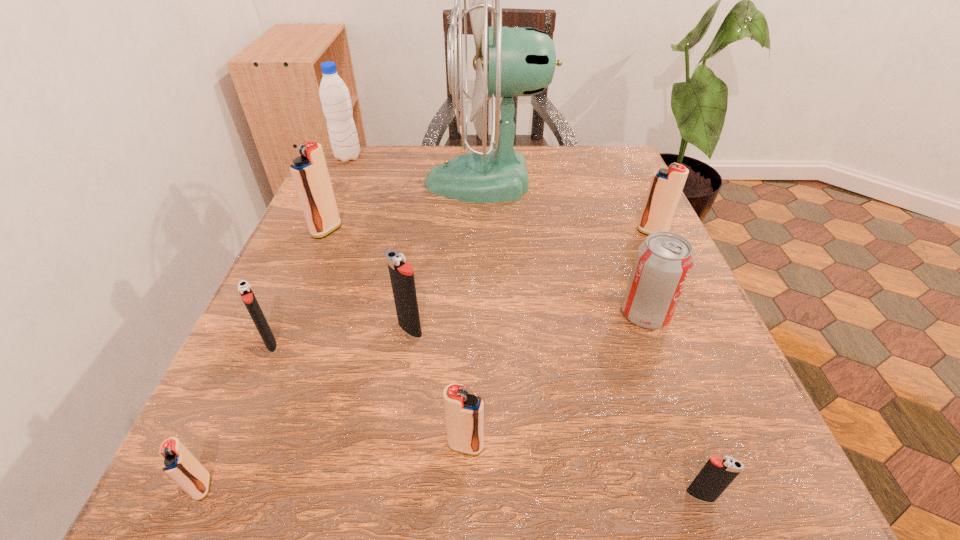
Locate an element on the screen. vacant area situated 0.110m on the right of the second tallest object is located at coordinates (406, 157).

At what (x,y) coordinates should I click in order to perform the action: click on blank area located on the front of the eighth shortest object. Please return your answer as a coordinate pair (x, y). This screenshot has width=960, height=540. Looking at the image, I should click on (308, 274).

Where is `free point located on the left of the rightmost igniter`? The width and height of the screenshot is (960, 540). free point located on the left of the rightmost igniter is located at coordinates (512, 233).

I want to click on vacant area located 0.110m on the left of the second black igniter from right to left, so click(x=327, y=329).

In order to click on vacant space located on the back of the gray soda can in this screenshot , I will do `click(611, 220)`.

The width and height of the screenshot is (960, 540). Identify the location of vacant space located on the front of the leftmost black igniter. (221, 458).

Locate an element on the screen. This screenshot has width=960, height=540. vacant space located on the right of the third biggest red igniter is located at coordinates (547, 446).

This screenshot has width=960, height=540. I want to click on vacant area situated on the back of the smallest red igniter, so click(280, 312).

The width and height of the screenshot is (960, 540). In order to click on vacant point located on the back of the nearest black igniter in this screenshot , I will do `click(632, 298)`.

At what (x,y) coordinates should I click in order to perform the action: click on fan present at the far edge. Please return your answer as a coordinate pair (x, y). This screenshot has width=960, height=540. Looking at the image, I should click on (521, 61).